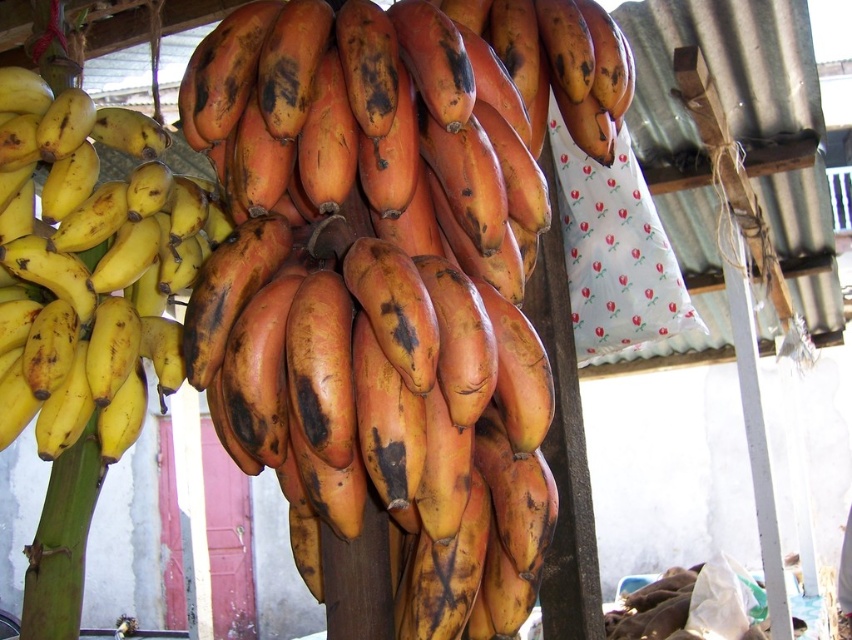
Can you confirm if ripe brown bananas at center is positioned below yellow matte bananas at left?

Indeed, ripe brown bananas at center is positioned under yellow matte bananas at left.

How far apart are ripe brown bananas at center and yellow matte bananas at left?

ripe brown bananas at center and yellow matte bananas at left are 12.65 inches apart from each other.

Does point (372, 376) lie behind point (9, 259)?

No, it is not.

Locate an element on the screen. ripe brown bananas at center is located at coordinates (367, 268).